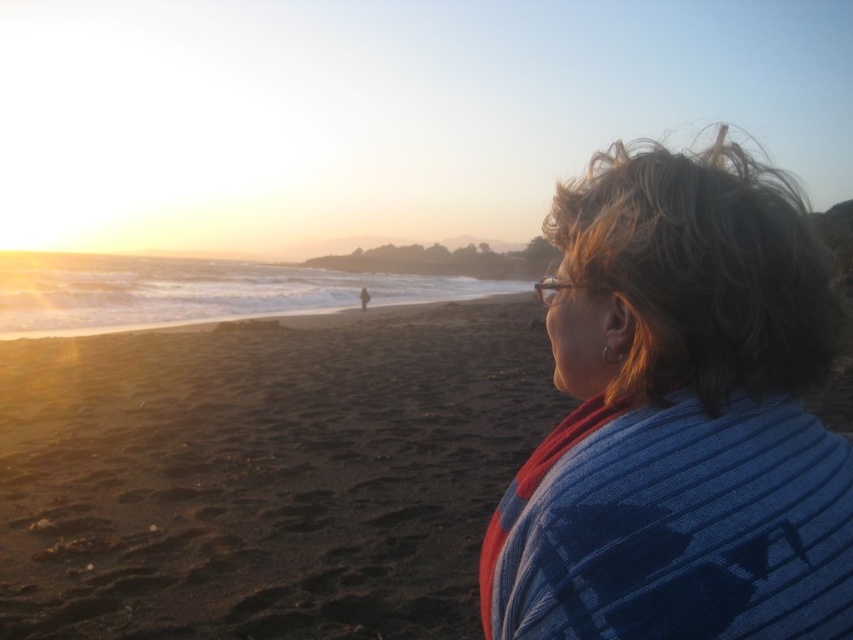
Does dark sand at lower left lie in front of blue knitted sweater at upper right?

No.

Is dark sand at lower left to the left of blue knitted sweater at upper right from the viewer's perspective?

Correct, you'll find dark sand at lower left to the left of blue knitted sweater at upper right.

Between point (312, 460) and point (737, 490), which one is positioned in front?

Point (737, 490)

The image size is (853, 640). I want to click on dark sand at lower left, so click(265, 474).